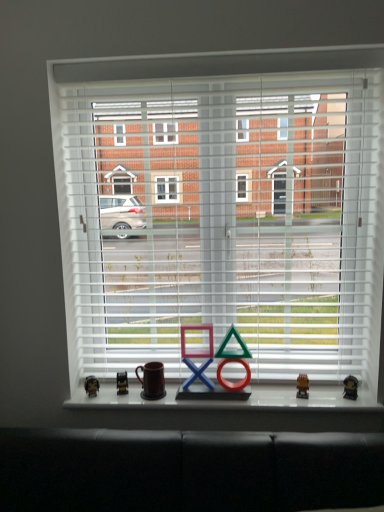
Question: From a real-world perspective, is white matte blinds at center below metallic gold figurine at right, which is the first miniature in right-to-left order?

Choices:
 (A) no
 (B) yes

Answer: (A)

Question: Does white matte blinds at center appear on the left side of metallic gold figurine at right, the fourth miniature in the left-to-right sequence?

Choices:
 (A) yes
 (B) no

Answer: (A)

Question: Is metallic gold figurine at right, the fourth miniature in the left-to-right sequence, located within white matte blinds at center?

Choices:
 (A) no
 (B) yes

Answer: (A)

Question: Can you confirm if white matte blinds at center is bigger than metallic gold figurine at right, which is the first miniature in right-to-left order?

Choices:
 (A) no
 (B) yes

Answer: (B)

Question: Does white matte blinds at center have a lesser height compared to metallic gold figurine at right, which is the first miniature in right-to-left order?

Choices:
 (A) no
 (B) yes

Answer: (A)

Question: Is point (307, 396) positioned closer to the camera than point (329, 77)?

Choices:
 (A) farther
 (B) closer

Answer: (A)

Question: Is metallic gold figurine at center, acting as the 3th miniature starting from the left, inside or outside of white matte blinds at center?

Choices:
 (A) inside
 (B) outside

Answer: (B)

Question: Is metallic gold figurine at center, acting as the 3th miniature starting from the left, taller or shorter than white matte blinds at center?

Choices:
 (A) tall
 (B) short

Answer: (B)

Question: From the image's perspective, is metallic gold figurine at center, which is counted as the 2th miniature, starting from the right, positioned above or below white matte blinds at center?

Choices:
 (A) above
 (B) below

Answer: (B)

Question: Is point (119, 374) closer or farther from the camera than point (306, 380)?

Choices:
 (A) closer
 (B) farther

Answer: (B)

Question: Which is correct: metallic gold miniature at lower left, which appears as the 3th miniature when viewed from the right, is inside metallic gold figurine at center, which is counted as the 2th miniature, starting from the right, or outside of it?

Choices:
 (A) outside
 (B) inside

Answer: (A)

Question: From the image's perspective, is metallic gold miniature at lower left, which appears as the second miniature when viewed from the left, located above or below metallic gold figurine at center, acting as the 3th miniature starting from the left?

Choices:
 (A) below
 (B) above

Answer: (A)

Question: Is metallic gold miniature at lower left, which appears as the second miniature when viewed from the left, taller or shorter than metallic gold figurine at center, acting as the 3th miniature starting from the left?

Choices:
 (A) short
 (B) tall

Answer: (B)

Question: Looking at their shapes, would you say metallic gold figurine at right, the fourth miniature in the left-to-right sequence, is wider or thinner than matte plastic game piece at center?

Choices:
 (A) thin
 (B) wide

Answer: (A)

Question: From their relative heights in the image, would you say metallic gold figurine at right, which is the first miniature in right-to-left order, is taller or shorter than matte plastic game piece at center?

Choices:
 (A) short
 (B) tall

Answer: (A)